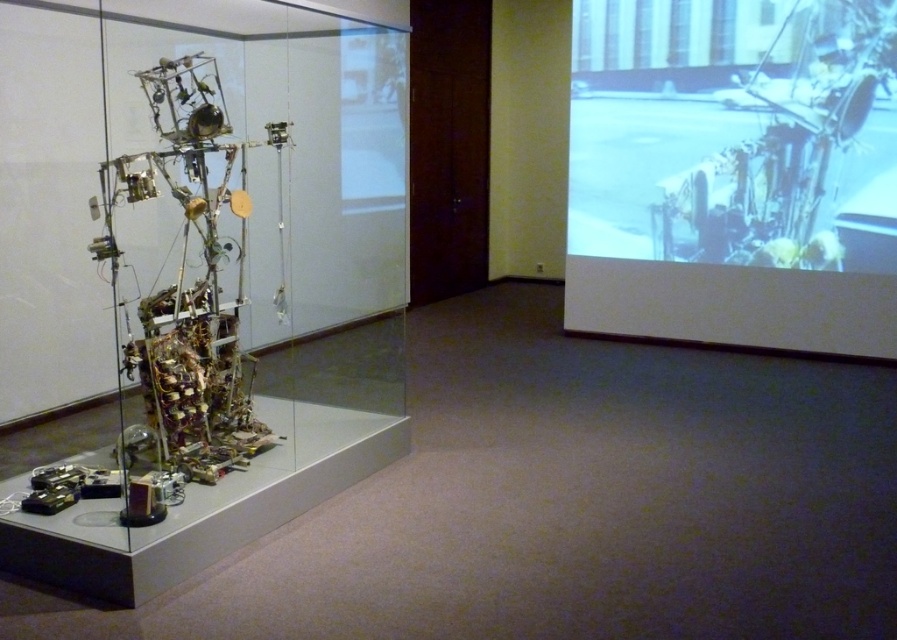
You are an art curator planning to move the transparent glass sculpture at left and the white matte screen at upper right to a new gallery. The new space has a height restriction of 2 meters. Can both items be moved without any modifications?

The transparent glass sculpture at left is taller than the white matte screen at upper right. Since the height restriction is 2 meters, we need to ensure both items are under this limit. However, without knowing their exact heights, it is impossible to determine if they can be moved without modifications. Additional measurements are required.

You are an art curator planning to install a new light fixture at point (193, 276). The existing transparent glass sculpture at left is located there. Can you place the light fixture at that point without moving the sculpture?

The transparent glass sculpture at left is already located at point (193, 276), so you cannot place the light fixture there without moving the sculpture.

You are an art curator planning to move the white matte screen at upper right closer to the transparent glass sculpture at left for a new exhibit layout. The minimum distance required between the two to ensure safety and visibility is 2 meters. Can you safely move the screen closer?

The transparent glass sculpture at left and white matte screen at upper right are currently 2.54 meters apart. Since the minimum required distance is 2 meters, moving the screen closer to 2 meters would still be safe and within the required distance.